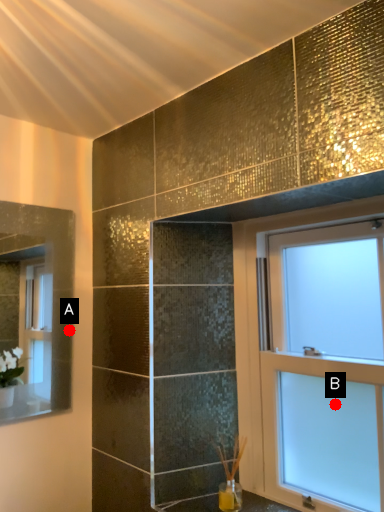
Question: Two points are circled on the image, labeled by A and B beside each circle. Which point is closer to the camera?

Choices:
 (A) A is closer
 (B) B is closer

Answer: (B)